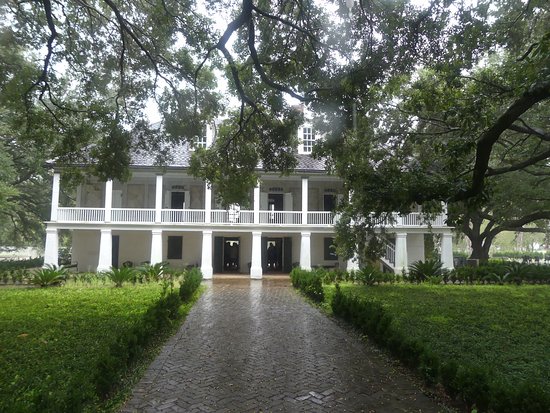
Where is `upper pillars`? The width and height of the screenshot is (550, 413). upper pillars is located at coordinates tap(158, 196), tap(207, 197).